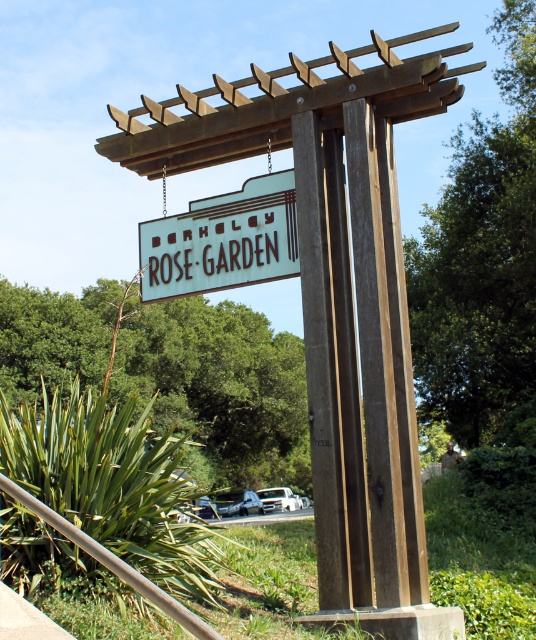
Based on the photo, can you confirm if brown wooden pergola at center is positioned above white wood sign at center?

Incorrect, brown wooden pergola at center is not positioned above white wood sign at center.

Is point (354, 220) behind point (154, 237)?

No, it is not.

The height and width of the screenshot is (640, 536). Identify the location of brown wooden pergola at center. (321, 291).